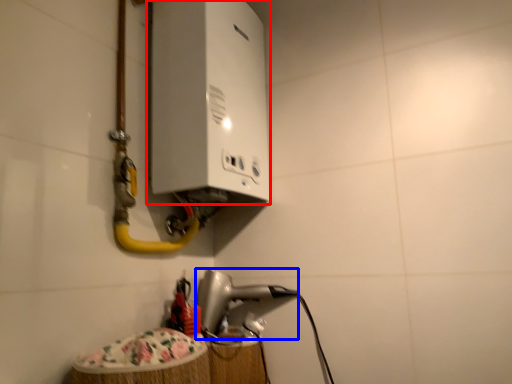
Question: Which point is further to the camera, appliance (highlighted by a red box) or appliance (highlighted by a blue box)?

Choices:
 (A) appliance
 (B) appliance

Answer: (B)